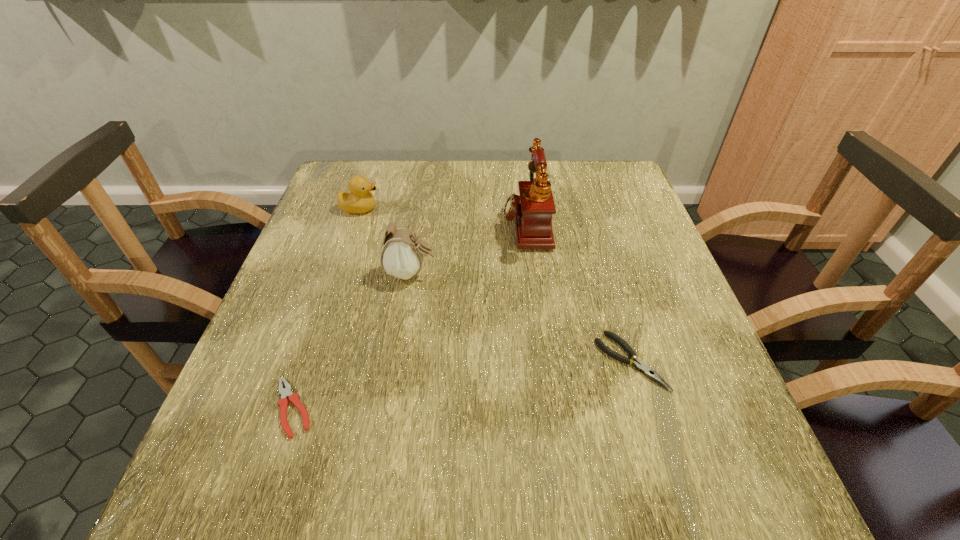
What are the coordinates of `vacant space in between the third tallest object and the left pliers` in the screenshot? It's located at (326, 308).

The image size is (960, 540). In order to click on blank region between the tallest object and the second shortest object in this screenshot , I will do `click(578, 293)`.

Where is `vacant point located between the rightmost object and the left pliers`? vacant point located between the rightmost object and the left pliers is located at coordinates (462, 384).

Where is `vacant space in between the taller pliers and the duckling`? This screenshot has width=960, height=540. vacant space in between the taller pliers and the duckling is located at coordinates (495, 285).

Where is `free spot between the third tallest object and the left pliers`? This screenshot has width=960, height=540. free spot between the third tallest object and the left pliers is located at coordinates (326, 308).

In order to click on vacant area that lies between the third object from left to right and the telephone in this screenshot , I will do `click(468, 248)`.

In order to click on vacant area that lies between the left pliers and the tallest object in this screenshot , I will do `click(410, 316)`.

Image resolution: width=960 pixels, height=540 pixels. In order to click on free space between the shorter pliers and the tallest object in this screenshot , I will do `click(410, 316)`.

Choose which object is the second nearest neighbor to the third shortest object. Please provide its 2D coordinates. Your answer should be formatted as a tuple, i.e. [(x, y)], where the tuple contains the x and y coordinates of a point satisfying the conditions above.

[(533, 208)]

Where is `object identified as the fourth closest to the taller pliers`? This screenshot has height=540, width=960. object identified as the fourth closest to the taller pliers is located at coordinates (359, 200).